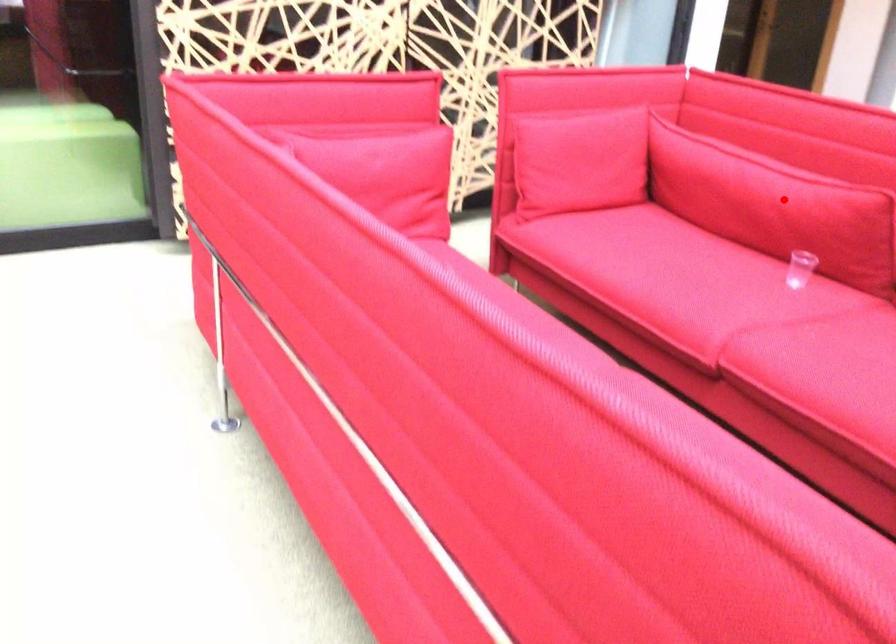
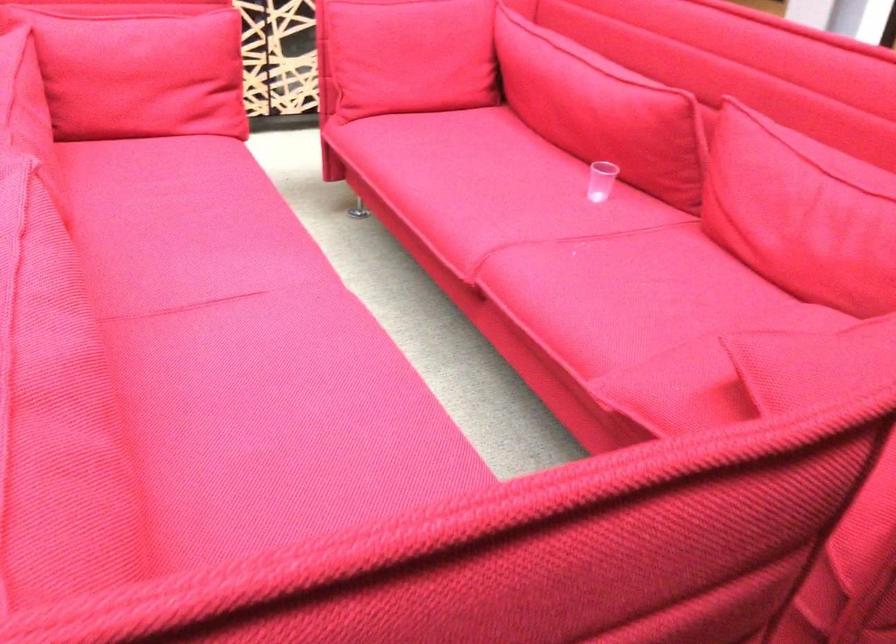
Question: I am providing you with two images of the same scene from different viewpoints. Image1 has a red point marked. In image2, the corresponding 3D location appears at what relative position? Reply with the corresponding letter.

Choices:
 (A) Closer
 (B) Farther

Answer: (A)